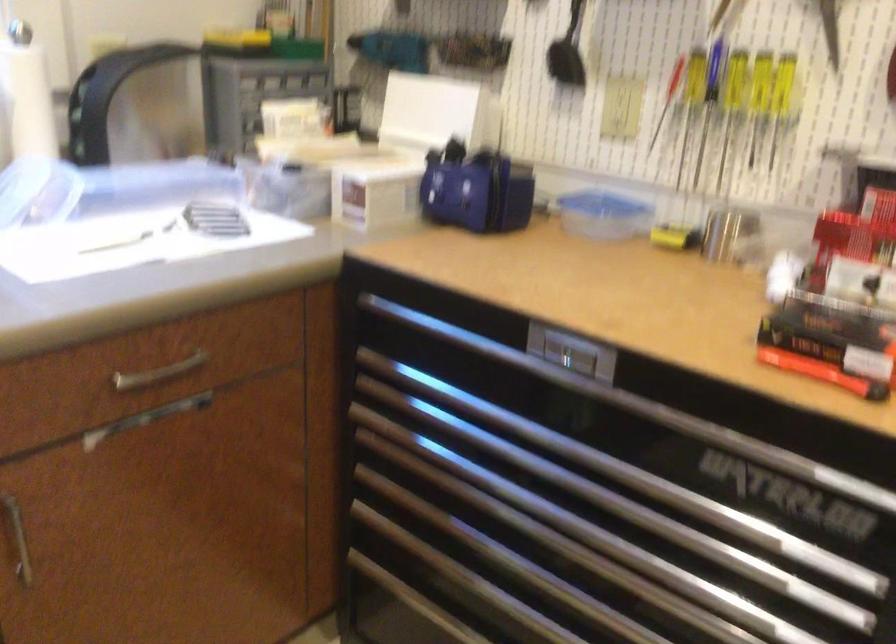
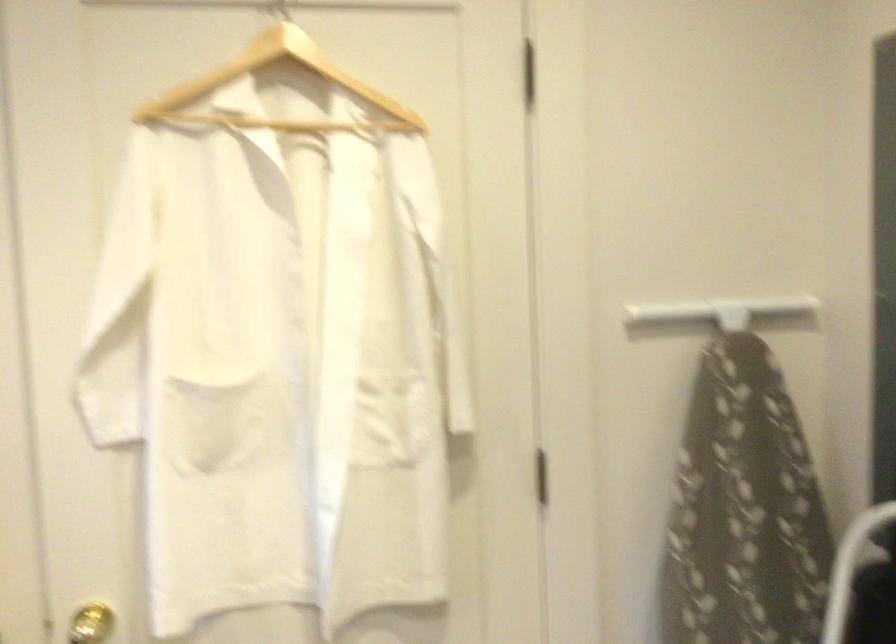
Question: The camera is either moving clockwise (left) or counter-clockwise (right) around the object. The first image is from the beginning of the video and the second image is from the end. Is the camera moving left or right when shooting the video?

Choices:
 (A) Left
 (B) Right

Answer: (A)